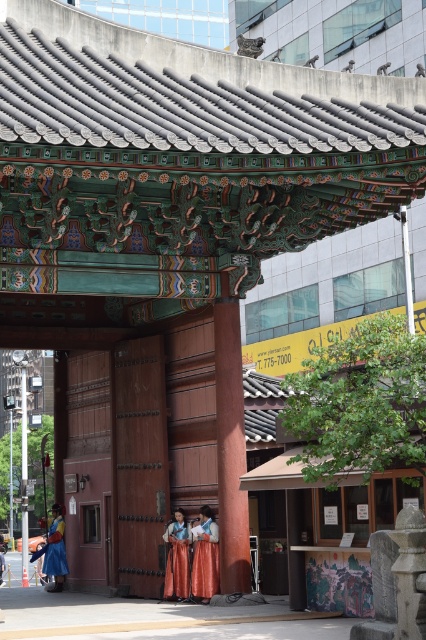
You are a photographer standing at the camera position. You want to take a photo of the traditional Korean gate. There is a point at coordinate point (209, 522) that is 23.91 meters away from you. Is this point likely part of the gate structure?

The point at coordinate point (209, 522) is 23.91 meters away from the camera. Given that the gate is the central structure in the image and the distance is reasonable for capturing the gate in a photo, this point is likely part of the gate structure.

You are a photographer planning to take a photo of the silk orange dress at center and the matte blue robe at lower left. Which of the two is closer to the camera based on their positions?

The silk orange dress at center is positioned over the matte blue robe at lower left, meaning it is closer to the camera.

You are standing at the entrance of the Haenggwan gate and want to reach the point marked as point [193,545]. If your walking speed is 3 feet per second, how many seconds will it take you to reach that point?

The distance between you and point [193,545] is 79.77 feet. At a speed of 3 feet per second, dividing the distance by speed gives 79.77 divided by 3 equals approximately 26.59 seconds. So, it will take about 26.6 seconds to reach the point.